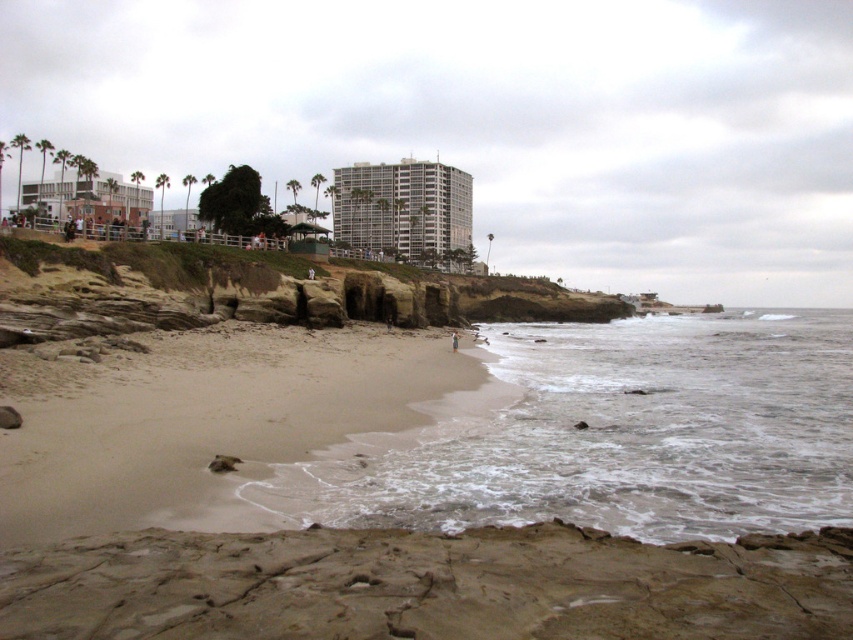
You are standing on the cliff overlooking the beach and want to walk down to the sandy beach at lower left. However, there is a brown sandy beach at lower center in your path. Which beach will you step onto first?

You will step onto the brown sandy beach at lower center first because it is closer to the viewer than the sandy beach at lower left.

You are standing on the cliff overlooking the coastal scene. You see the brown sandy beach at lower center and the sandy beach at lower left. Which beach is closer to your current position?

The brown sandy beach at lower center is closer to your current position because it is located below the sandy beach at lower left, meaning it is situated lower in elevation.

You are standing at the beach and want to take a photo of both the point at coordinates point (276, 560) and point (172, 522). Which point should you focus on first to ensure both are in clear view?

You should focus on point (276, 560) first since it is closer to the camera than point (172, 522). This ensures both points are in focus as the depth of field will cover the farther point.